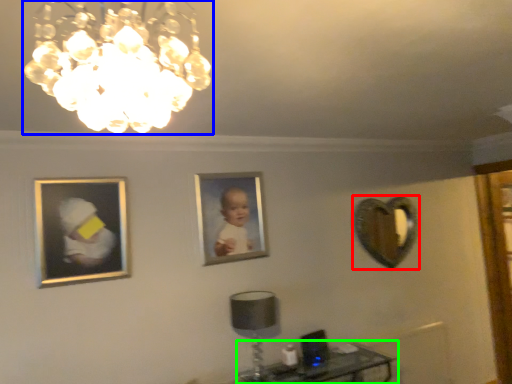
Question: Which is farther away from mirror (highlighted by a red box)? lamp (highlighted by a blue box) or table (highlighted by a green box)?

Choices:
 (A) lamp
 (B) table

Answer: (A)